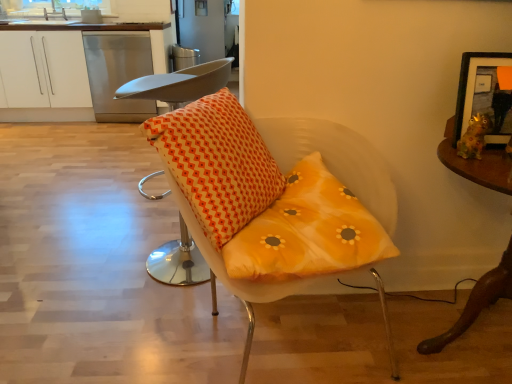
Question: Considering the positions of orange printed cushion at center and stainless steel dishwasher at upper left in the image, is orange printed cushion at center bigger or smaller than stainless steel dishwasher at upper left?

Choices:
 (A) big
 (B) small

Answer: (B)

Question: Considering the positions of orange printed cushion at center and stainless steel dishwasher at upper left in the image, is orange printed cushion at center wider or thinner than stainless steel dishwasher at upper left?

Choices:
 (A) thin
 (B) wide

Answer: (A)

Question: Which of these objects is positioned farthest from the white matte cabinet at upper left?

Choices:
 (A) stainless steel dishwasher at upper left
 (B) wooden table at right
 (C) orange fabric cushion at center, arranged as the 1th chair when viewed from the left
 (D) yellow fabric cushion at center, which is counted as the second chair, starting from the left
 (E) wooden framed picture at upper right

Answer: (B)

Question: Which object is positioned closest to the orange printed cushion at center?

Choices:
 (A) white matte cabinet at upper left
 (B) stainless steel dishwasher at upper left
 (C) wooden framed picture at upper right
 (D) orange fabric cushion at center, positioned as the second chair in right-to-left order
 (E) yellow fabric cushion at center, placed as the 1th chair when sorted from right to left

Answer: (E)